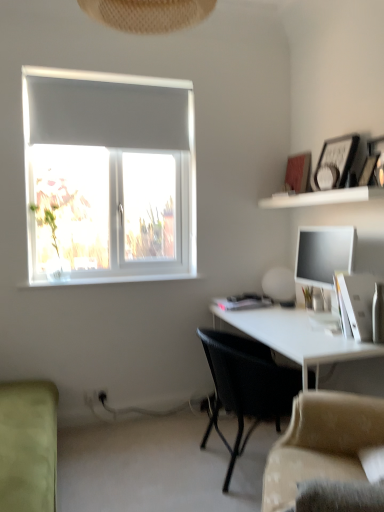
Where is `vacant area situated to the left side of black woven chair at center`? vacant area situated to the left side of black woven chair at center is located at coordinates (147, 460).